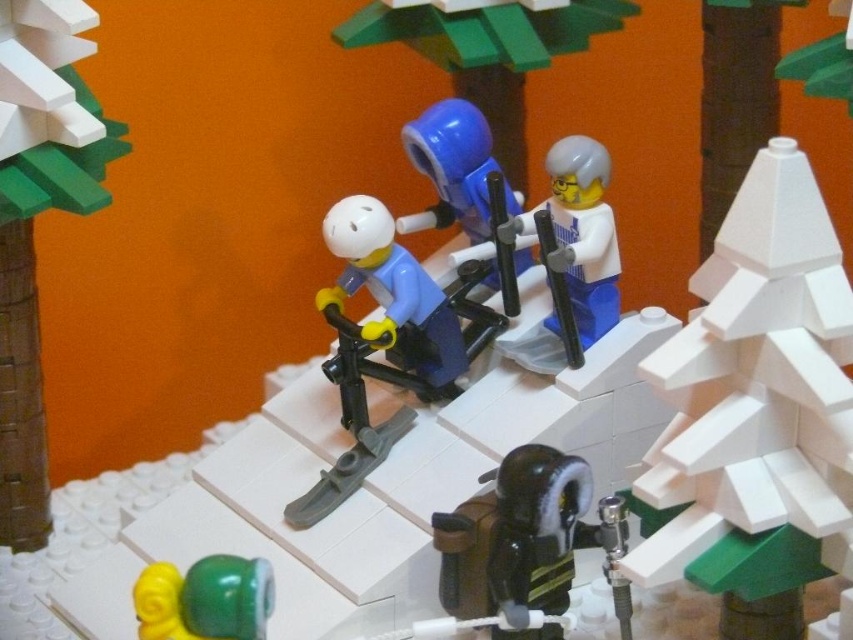
You are a Lego figure trying to reach the white matte tree at upper right from the white matte figure at center. Considering their sizes, which one is bigger?

The white matte tree at upper right is larger in size compared to the white matte figure at center.

You are a Lego figure trying to reach the white matte tree at upper right from the white matte figure at center. Which direction should you move?

The white matte tree at upper right is positioned under the white matte figure at center, so you should move downward to reach it.